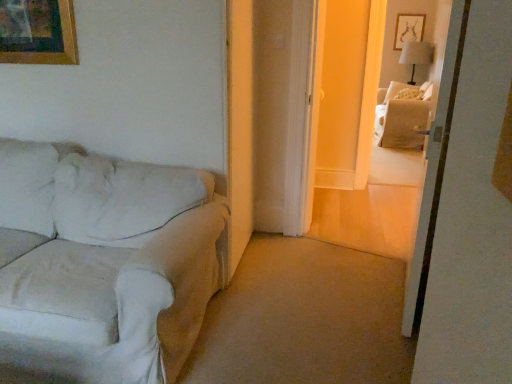
Question: From the image's perspective, is white fabric couch at left located beneath white fabric lampshade at upper right?

Choices:
 (A) no
 (B) yes

Answer: (B)

Question: From a real-world perspective, is white fabric couch at left over white fabric lampshade at upper right?

Choices:
 (A) yes
 (B) no

Answer: (B)

Question: From a real-world perspective, is white fabric couch at left physically below white fabric lampshade at upper right?

Choices:
 (A) yes
 (B) no

Answer: (A)

Question: Would you say white fabric couch at left is a long distance from white fabric lampshade at upper right?

Choices:
 (A) yes
 (B) no

Answer: (A)

Question: Is the depth of white fabric couch at left less than that of white fabric lampshade at upper right?

Choices:
 (A) no
 (B) yes

Answer: (B)

Question: Considering the relative sizes of white fabric couch at left and white fabric lampshade at upper right in the image provided, is white fabric couch at left wider than white fabric lampshade at upper right?

Choices:
 (A) no
 (B) yes

Answer: (B)

Question: Can you confirm if white fabric lampshade at upper right is smaller than white fabric bed at upper right?

Choices:
 (A) no
 (B) yes

Answer: (B)

Question: Is white fabric lampshade at upper right not close to white fabric bed at upper right?

Choices:
 (A) no
 (B) yes

Answer: (B)

Question: Does white fabric lampshade at upper right turn towards white fabric bed at upper right?

Choices:
 (A) yes
 (B) no

Answer: (A)

Question: Can you confirm if white fabric lampshade at upper right is wider than white fabric bed at upper right?

Choices:
 (A) no
 (B) yes

Answer: (B)

Question: Does white fabric lampshade at upper right have a lesser height compared to white fabric bed at upper right?

Choices:
 (A) no
 (B) yes

Answer: (B)

Question: Is white fabric lampshade at upper right next to white fabric bed at upper right?

Choices:
 (A) yes
 (B) no

Answer: (B)

Question: From a real-world perspective, is white fabric lampshade at upper right located higher than beige fabric couch at upper right?

Choices:
 (A) yes
 (B) no

Answer: (A)